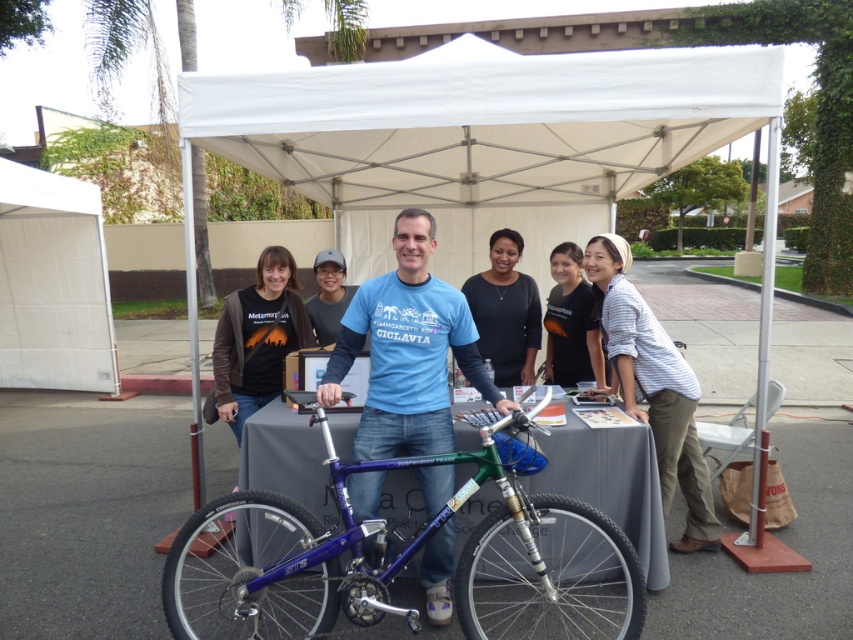
Question: Which point appears closest to the camera in this image?

Choices:
 (A) (68, 192)
 (B) (618, 292)

Answer: (B)

Question: Observing the image, what is the correct spatial positioning of white fabric tent at center in reference to white fabric canopy at left?

Choices:
 (A) above
 (B) below

Answer: (A)

Question: Among these points, which one is nearest to the camera?

Choices:
 (A) (337, 296)
 (B) (219, 589)
 (C) (590, 376)
 (D) (233, 417)

Answer: (B)

Question: Is dark gray sweater at center further to the viewer compared to black cotton shirt at center?

Choices:
 (A) no
 (B) yes

Answer: (B)

Question: Which point appears farthest from the camera in this image?

Choices:
 (A) (489, 392)
 (B) (325, 260)
 (C) (645, 396)
 (D) (497, 369)

Answer: (B)

Question: Can you confirm if shiny purple bike at center is thinner than matte gray shirt at center?

Choices:
 (A) no
 (B) yes

Answer: (A)